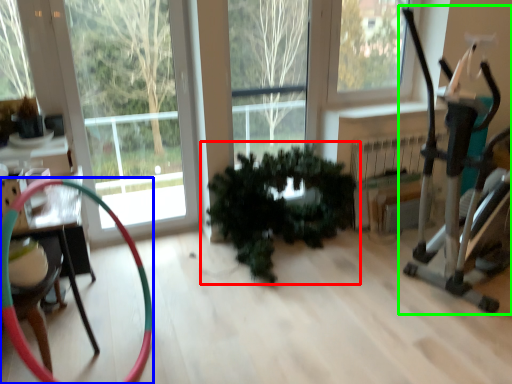
Question: Which object is positioned closest to houseplant (highlighted by a red box)? Select from garden hose (highlighted by a blue box) and baby carriage (highlighted by a green box).

Choices:
 (A) garden hose
 (B) baby carriage

Answer: (B)